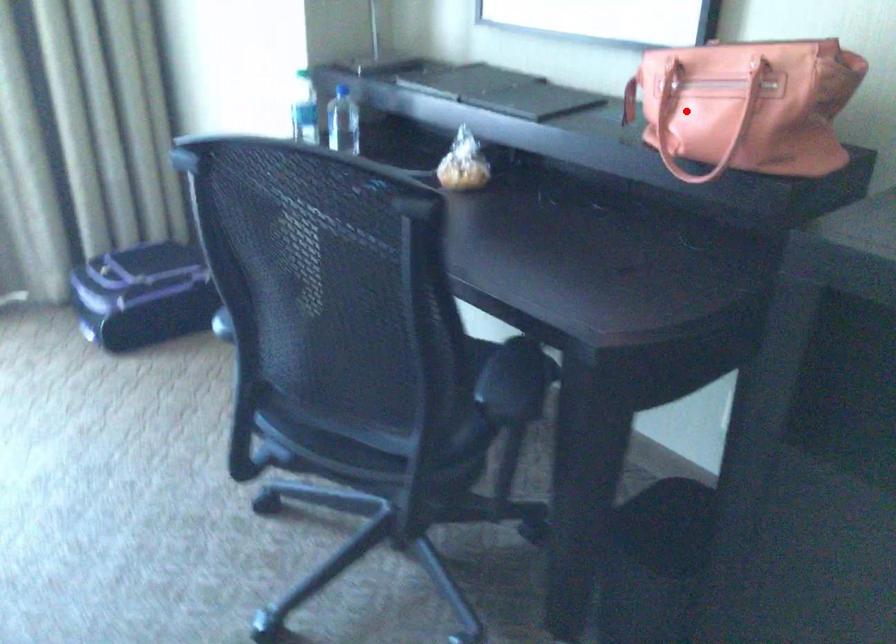
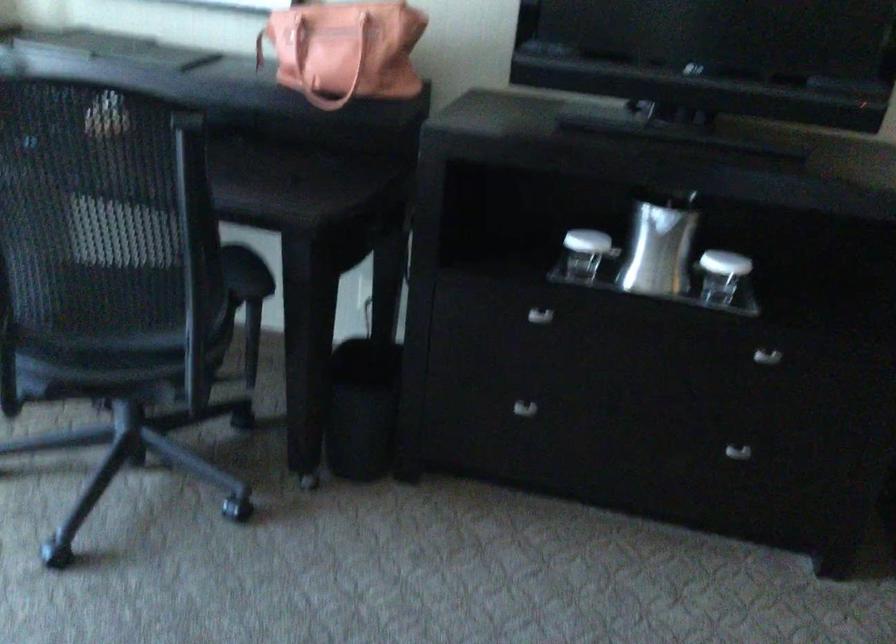
Find the pixel in the second image that matches the highlighted location in the first image.

(315, 57)